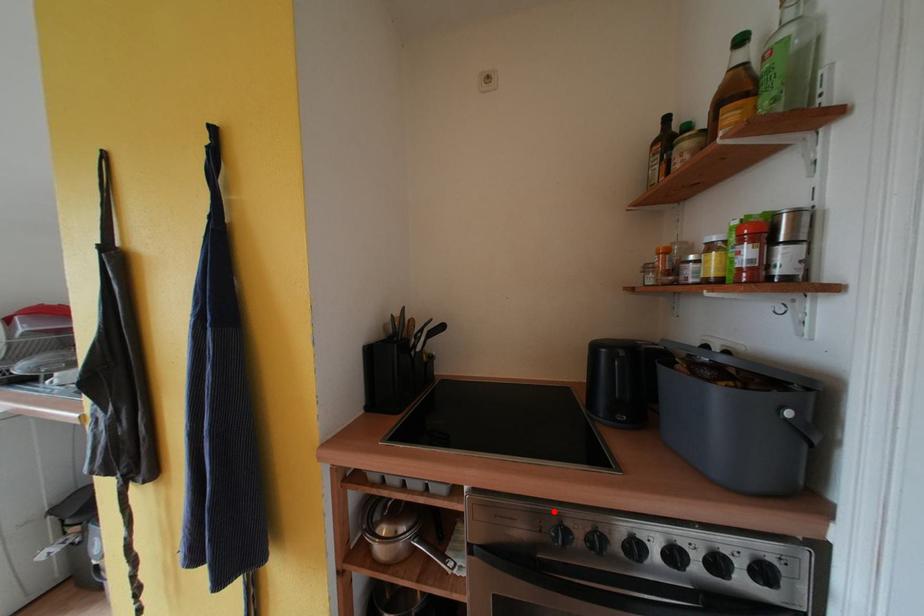
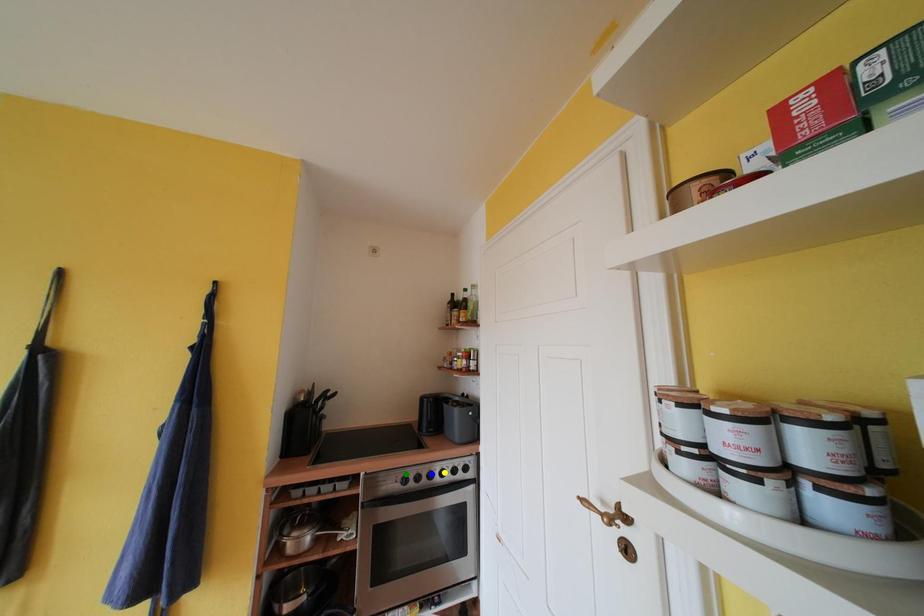
Question: I am providing you with two images of the same scene from different viewpoints. A red point is marked on the first image. You are given multiple points on the second image. Which point in image 2 is actually the same real-world point as the red point in image 1?

Choices:
 (A) blue point
 (B) yellow point
 (C) green point

Answer: (C)